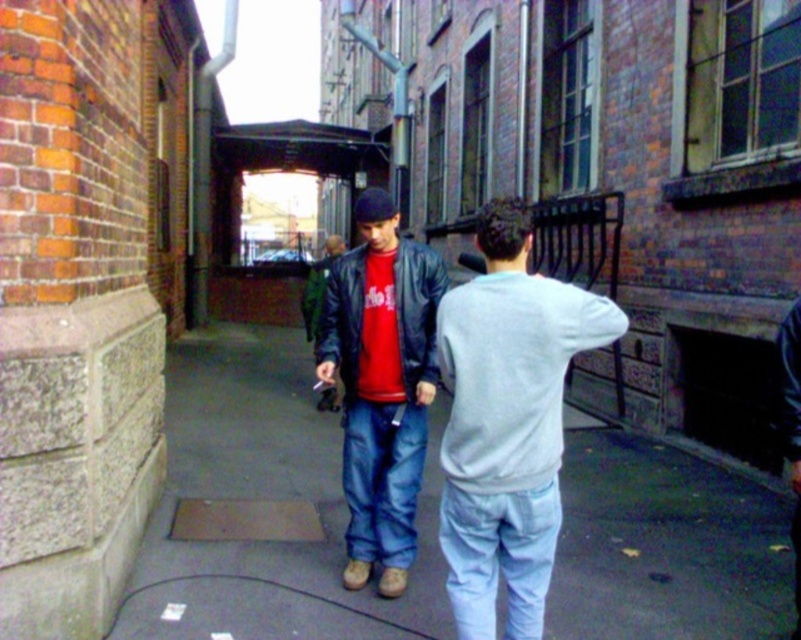
Does light gray sweatshirt at center have a smaller size compared to matte black jacket at center?

Indeed, light gray sweatshirt at center has a smaller size compared to matte black jacket at center.

Can you confirm if light gray sweatshirt at center is bigger than matte black jacket at center?

Actually, light gray sweatshirt at center might be smaller than matte black jacket at center.

Between point (506, 440) and point (320, 326), which one is positioned in front?

Positioned in front is point (506, 440).

Find the location of `light gray sweatshirt at center`. light gray sweatshirt at center is located at coordinates (506, 422).

Is light gray sweatshirt at center wider than matte black leather jacket at center?

Yes.

Between light gray sweatshirt at center and matte black leather jacket at center, which one appears on the left side from the viewer's perspective?

Positioned to the left is matte black leather jacket at center.

In order to click on light gray sweatshirt at center in this screenshot , I will do `click(506, 422)`.

Is matte black leather jacket at center closer to camera compared to matte black jacket at center?

Yes.

Can you confirm if matte black leather jacket at center is smaller than matte black jacket at center?

Correct, matte black leather jacket at center occupies less space than matte black jacket at center.

Which is in front, point (355, 424) or point (304, 317)?

Positioned in front is point (355, 424).

Find the location of a particular element. This screenshot has height=640, width=801. matte black leather jacket at center is located at coordinates (381, 385).